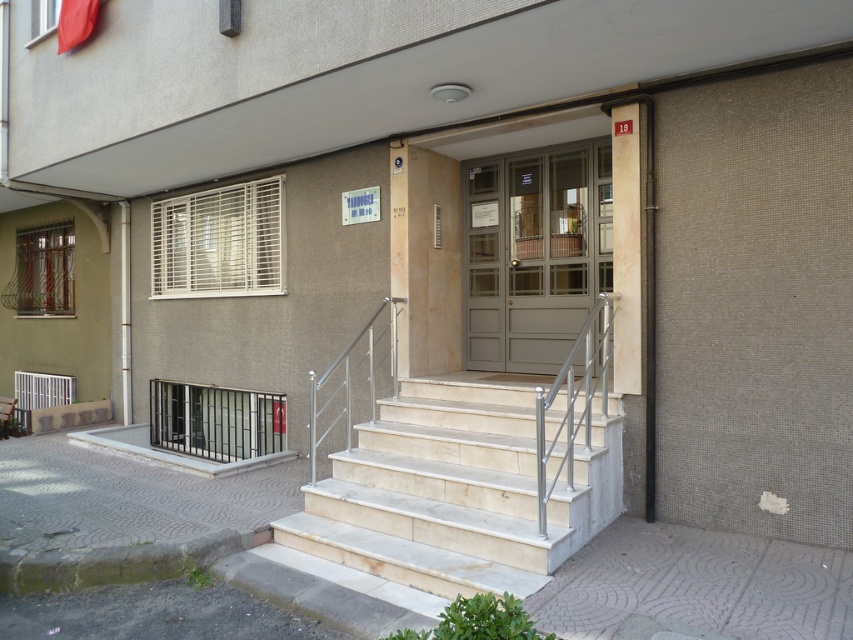
Looking at this image, you are standing at the entrance of the building and want to take a photo of both the point at coordinates (614, 442) and the point at coordinates (354, 419). Which point should you focus on first to ensure both are in clear view?

You should focus on point (614, 442) first because it is closer to the camera than point (354, 419). This ensures both points will be in focus when taking the photo.